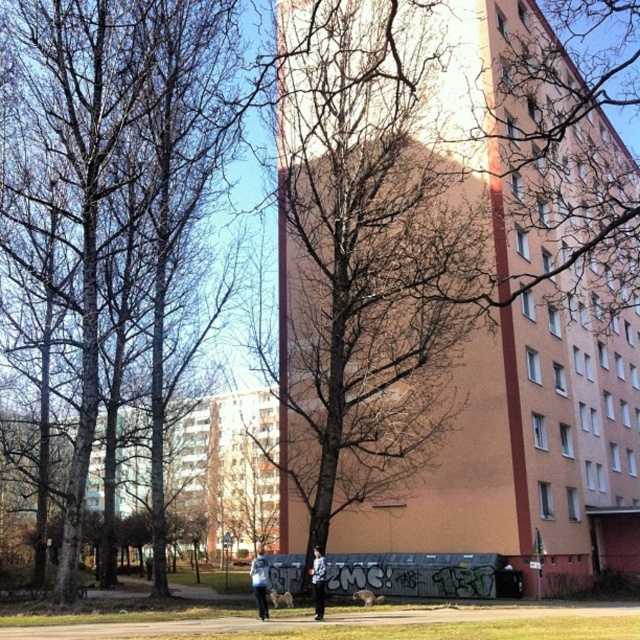
You are a photographer aiming to capture both the light blue fabric jacket at lower center and the light blue denim jacket at lower center in a single shot. Given their positions, which jacket would require you to adjust your camera angle more to ensure both are fully visible?

The light blue fabric jacket at lower center requires more adjustment since it is wider than the light blue denim jacket at lower center, necessitating a wider angle or closer positioning to include its full width in the frame.

You are a photographer trying to capture both the light blue fabric jacket at lower center and the light blue denim jacket at lower center in a single shot. Which jacket should you focus on first to ensure both are in frame?

The light blue fabric jacket at lower center is positioned under the light blue denim jacket at lower center, so focusing on the light blue denim jacket at lower center first would allow the photographer to include both jackets in the frame.